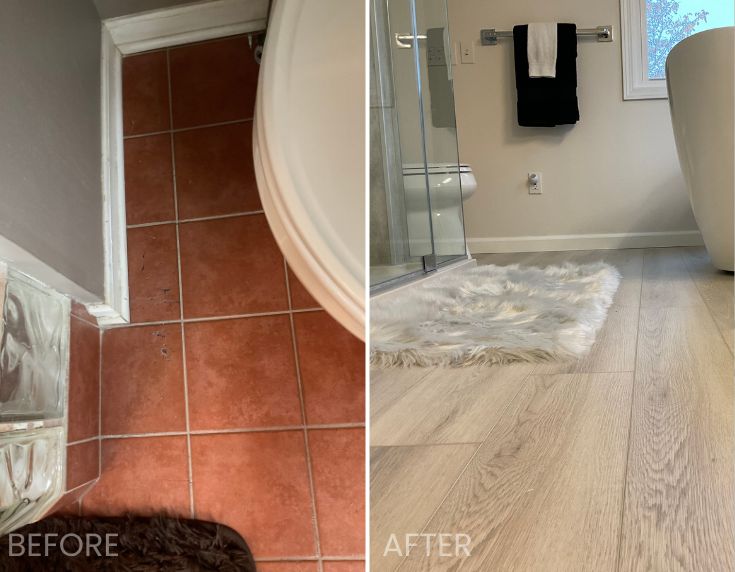
What are the coordinates of `rug` in the screenshot? It's located at (492, 329).